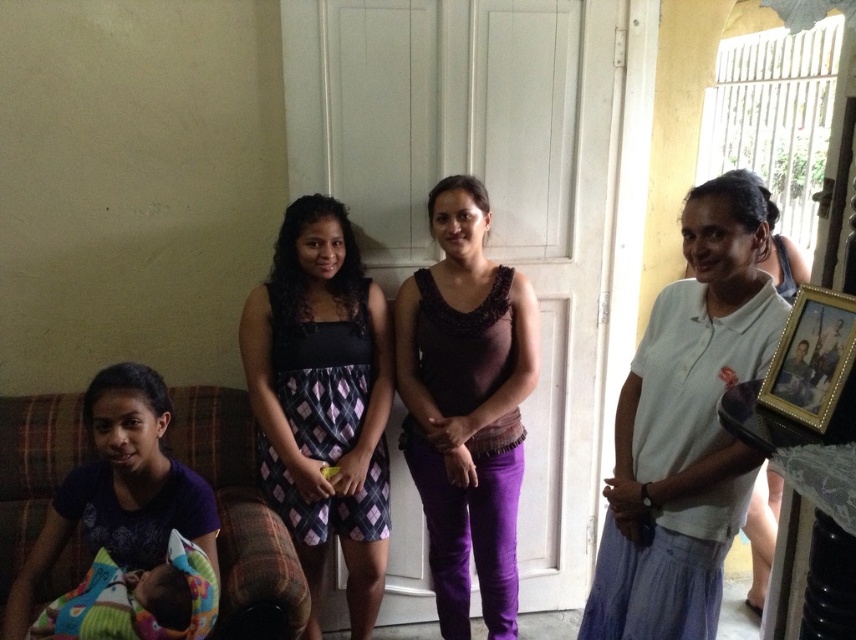
Which of these two, white cotton shirt at right or plaid fabric dress at center, stands shorter?

white cotton shirt at right

Who is positioned more to the right, white cotton shirt at right or plaid fabric dress at center?

white cotton shirt at right

Who is more distant from viewer, [646,627] or [372,493]?

The point [372,493] is more distant.

What are the coordinates of `white cotton shirt at right` in the screenshot? It's located at (687, 428).

Is plaid fabric dress at center positioned in front of fluffy multicolored blanket at lower left?

No.

Is point (355, 563) closer to camera compared to point (165, 552)?

No.

This screenshot has width=856, height=640. I want to click on plaid fabric dress at center, so click(324, 401).

Is white cotton shirt at right wider than plaid fabric couch at lower left?

No, white cotton shirt at right is not wider than plaid fabric couch at lower left.

Describe the element at coordinates (687, 428) in the screenshot. I see `white cotton shirt at right` at that location.

Locate an element on the screen. white cotton shirt at right is located at coordinates (687, 428).